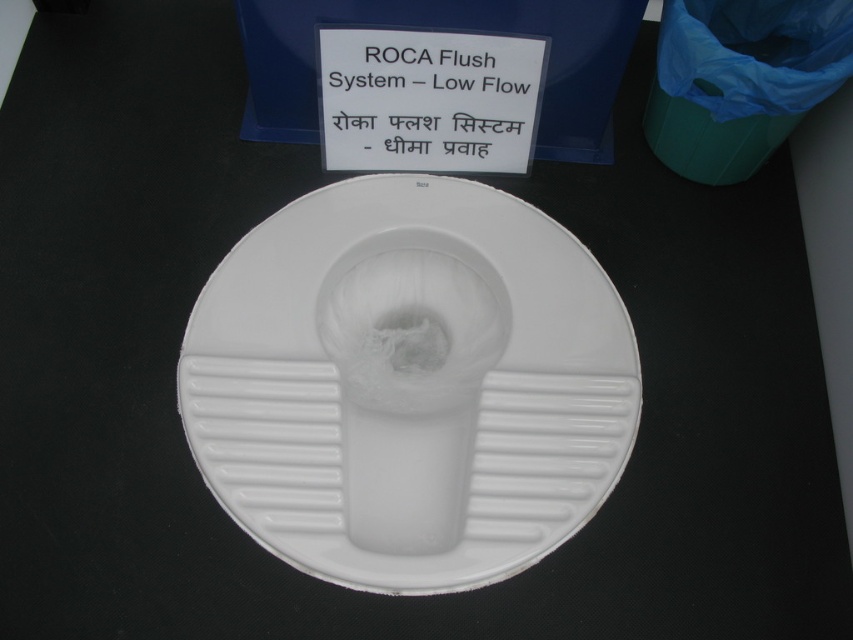
Is white matte toilet at center below white plastic sign at upper center?

Indeed, white matte toilet at center is positioned under white plastic sign at upper center.

Who is more distant from viewer, (267, 509) or (408, 144)?

Positioned behind is point (408, 144).

You are a GUI agent. You are given a task and a screenshot of the screen. Output one action in this format:
    pyautogui.click(x=<x>, y=<y>)
    Task: Click on the white matte toilet at center
    This screenshot has height=640, width=853.
    Given the screenshot: What is the action you would take?
    pyautogui.click(x=409, y=385)